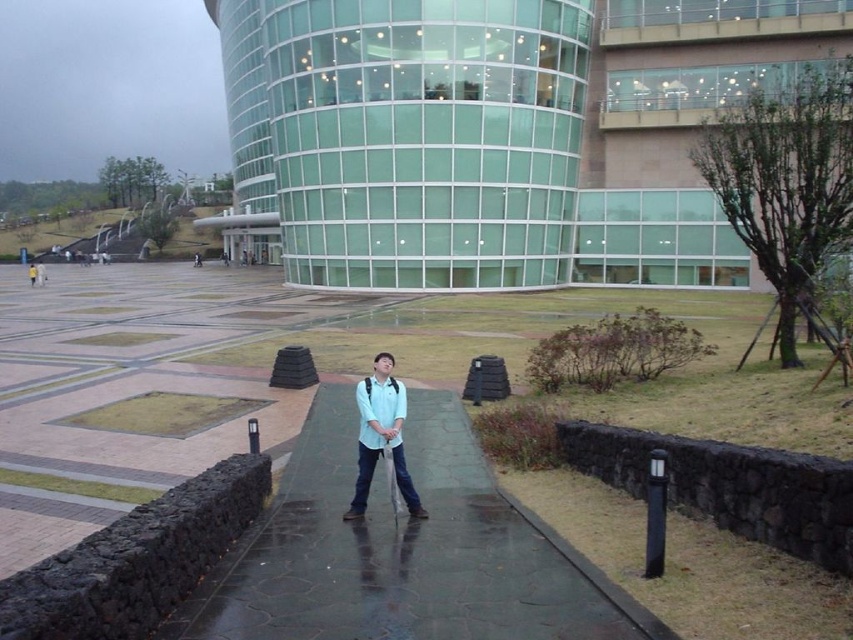
You are standing at the entrance of the building and want to walk towards the person with the matte blue shirt at center. Which direction should you move relative to the smooth concrete path at center?

Since the smooth concrete path at center is closer to the viewer than the matte blue shirt at center, you should move forward along the smooth concrete path at center towards the building to reach the person.

You are standing on the smooth concrete path at center and want to step onto the matte blue shirt at center. Is this possible?

The smooth concrete path at center is positioned under matte blue shirt at center, so stepping onto the matte blue shirt at center would require moving upwards, which is not possible from the ground level.

You are a visitor approaching the modern building and notice the smooth concrete path at center and the matte blue shirt at center. Which object is larger in size?

The matte blue shirt at center is larger than the smooth concrete path at center.